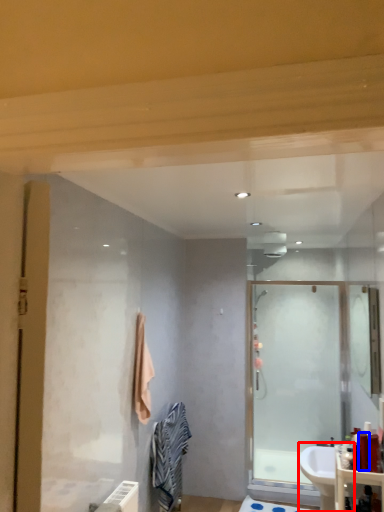
Question: Which of the following is the closest to the observer, sink (highlighted by a red box) or toiletry (highlighted by a blue box)?

Choices:
 (A) sink
 (B) toiletry

Answer: (B)